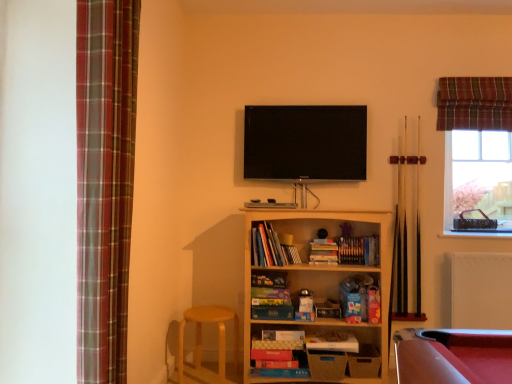
Question: Can you confirm if flat screen tv at upper center is taller than hardcover books at center, which ranks as the second book in top-to-bottom order?

Choices:
 (A) no
 (B) yes

Answer: (B)

Question: Is flat screen tv at upper center at the right side of hardcover books at center, marked as the second book in a bottom-to-top arrangement?

Choices:
 (A) no
 (B) yes

Answer: (A)

Question: From a real-world perspective, is flat screen tv at upper center under hardcover books at center, which ranks as the second book in top-to-bottom order?

Choices:
 (A) no
 (B) yes

Answer: (A)

Question: Is flat screen tv at upper center aimed at hardcover books at center, which appears as the second book when viewed from the right?

Choices:
 (A) no
 (B) yes

Answer: (A)

Question: Would you say hardcover books at center, marked as the second book in a bottom-to-top arrangement, is part of flat screen tv at upper center's contents?

Choices:
 (A) no
 (B) yes

Answer: (A)

Question: Considering the relative sizes of flat screen tv at upper center and hardcover books at center, which appears as the second book when viewed from the right, in the image provided, is flat screen tv at upper center bigger than hardcover books at center, which appears as the second book when viewed from the right,?

Choices:
 (A) yes
 (B) no

Answer: (A)

Question: Considering the relative sizes of plaid fabric curtain at left, the 1th curtain viewed from the front, and hardcover books at center, marked as the second book in a bottom-to-top arrangement, in the image provided, is plaid fabric curtain at left, the 1th curtain viewed from the front, thinner than hardcover books at center, marked as the second book in a bottom-to-top arrangement,?

Choices:
 (A) yes
 (B) no

Answer: (B)

Question: From the image's perspective, is plaid fabric curtain at left, the 1th curtain viewed from the front, over hardcover books at center, marked as the second book in a bottom-to-top arrangement?

Choices:
 (A) no
 (B) yes

Answer: (B)

Question: Considering the relative positions of plaid fabric curtain at left, the second curtain viewed from the back, and hardcover books at center, which appears as the second book when viewed from the right, in the image provided, is plaid fabric curtain at left, the second curtain viewed from the back, to the left of hardcover books at center, which appears as the second book when viewed from the right, from the viewer's perspective?

Choices:
 (A) yes
 (B) no

Answer: (A)

Question: Considering the relative sizes of plaid fabric curtain at left, the second curtain viewed from the back, and hardcover books at center, which appears as the second book when viewed from the right, in the image provided, is plaid fabric curtain at left, the second curtain viewed from the back, taller than hardcover books at center, which appears as the second book when viewed from the right,?

Choices:
 (A) yes
 (B) no

Answer: (A)

Question: From the image's perspective, is plaid fabric curtain at left, the second curtain viewed from the back, under hardcover books at center, which appears as the second book when viewed from the right?

Choices:
 (A) no
 (B) yes

Answer: (A)

Question: Is plaid fabric curtain at left, the second curtain viewed from the back, in contact with hardcover books at center, marked as the second book in a bottom-to-top arrangement?

Choices:
 (A) yes
 (B) no

Answer: (B)

Question: Considering the relative sizes of plaid fabric curtain at upper right, the first curtain viewed from the back, and brown wooden pool cue at right, arranged as the second cue when viewed from the right, in the image provided, is plaid fabric curtain at upper right, the first curtain viewed from the back, thinner than brown wooden pool cue at right, arranged as the second cue when viewed from the right,?

Choices:
 (A) yes
 (B) no

Answer: (B)